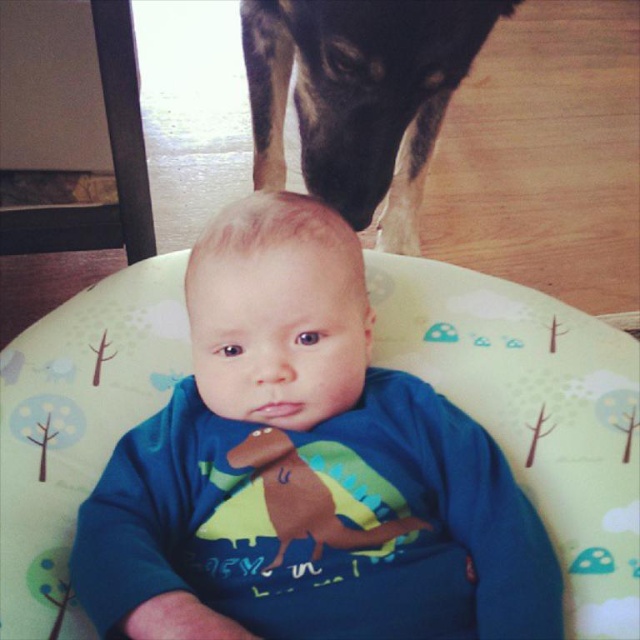
You are a photographer setting up for a family portrait. You need to position a blue soft baby at center and a black fur dog at upper center so that the baby is visible in the final shot. Based on their positions, will the dog block the baby from the camera view?

The blue soft baby at center is below the black fur dog at upper center, so the dog is positioned above the baby. This means the dog might block the baby from the camera view unless adjusted to ensure the baby remains visible.

You are a photographer trying to capture a photo of the black fur dog at upper center and the blue soft baby at center. From the baby and dog positions, which one is closer to the left side of the image?

The blue soft baby at center is closer to the left side of the image than the black fur dog at upper center.

You are a photographer setting up a photo shoot. You want to ensure the blue soft baby at center and the black fur dog at upper center are both in focus. Given their positions, which one should you focus on first to ensure both are sharp?

The blue soft baby at center is in front of the black fur dog at upper center, so you should focus on the blue soft baby at center first. This way, both will be in focus as the dog is behind the baby.